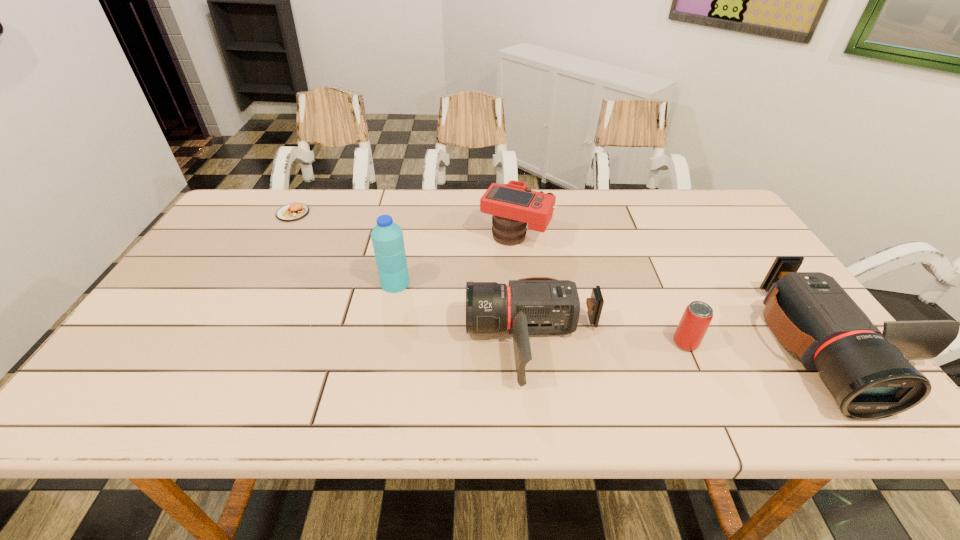
Find the location of a particular element. the fourth closest object to the right camcorder is located at coordinates (387, 237).

Choose which object is the fifth nearest neighbor to the rightmost object. Please provide its 2D coordinates. Your answer should be formatted as a tuple, i.e. [(x, y)], where the tuple contains the x and y coordinates of a point satisfying the conditions above.

[(291, 212)]

This screenshot has width=960, height=540. Find the location of `vacant point that satisfies the following two spatial constraints: 1. on the lens of the beer can; 2. on the left side of the left camcorder`. vacant point that satisfies the following two spatial constraints: 1. on the lens of the beer can; 2. on the left side of the left camcorder is located at coordinates (534, 343).

The image size is (960, 540). What are the coordinates of `free space in the image that satisfies the following two spatial constraints: 1. on the lens of the shorter camcorder; 2. on the left side of the beer can` in the screenshot? It's located at (534, 343).